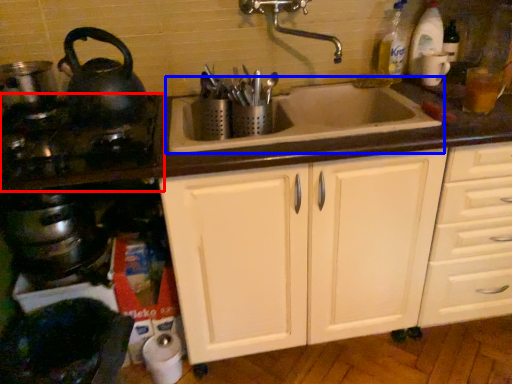
Question: Among these objects, which one is farthest to the camera, gas stove (highlighted by a red box) or sink (highlighted by a blue box)?

Choices:
 (A) gas stove
 (B) sink

Answer: (B)